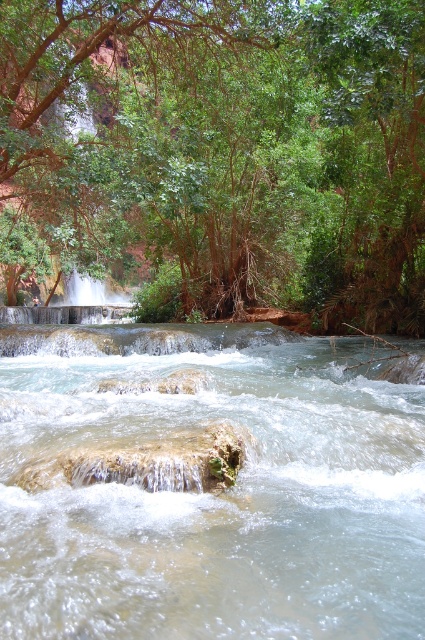
You are standing at the point marked by the coordinates point (218,152) in the image. Looking around, you notice a green leafy tree at upper center. Based on your position, which direction would you face to look towards the green leafy tree at upper center?

The point (218,152) corresponds to the green leafy tree at upper center, so you are already facing the tree. Therefore, you don not need to change your direction to look towards it.

You are standing at the center of the image and want to locate the clear water stream at center. What are the coordinates where you should look?

The clear water stream at center is located at coordinates point (212, 492).

You are standing at the edge of the river and want to take a photo of both the clear water stream at center and the green leafy tree at upper right. Which object should you focus on first to ensure it appears sharp in your photo?

You should focus on the clear water stream at center first because it is closer to the viewer than the green leafy tree at upper right, so focusing on the closer object ensures it will be sharp, and the tree in the background may naturally be in focus or require adjusting the camera settings for depth of field.